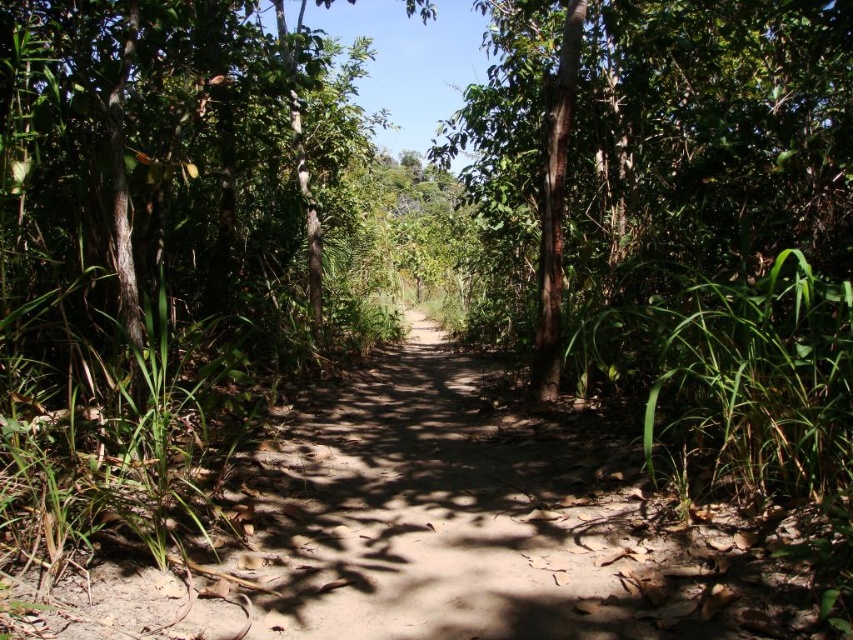
Question: Can you confirm if green leafy tree at center is bigger than green rough bark tree at center?

Choices:
 (A) no
 (B) yes

Answer: (A)

Question: Which of the following is the closest to the observer?

Choices:
 (A) (230, 580)
 (B) (247, 77)
 (C) (589, 192)

Answer: (A)

Question: Is green leafy tree at center above green rough bark tree at center?

Choices:
 (A) yes
 (B) no

Answer: (B)

Question: Estimate the real-world distances between objects in this image. Which object is farther from the brown sandy dirt track at center?

Choices:
 (A) green leafy tree at center
 (B) green rough bark tree at center

Answer: (B)

Question: Is brown sandy dirt track at center thinner than green leafy tree at center?

Choices:
 (A) yes
 (B) no

Answer: (B)

Question: Estimate the real-world distances between objects in this image. Which object is farther from the brown sandy dirt track at center?

Choices:
 (A) green leafy tree at center
 (B) green rough bark tree at center

Answer: (B)